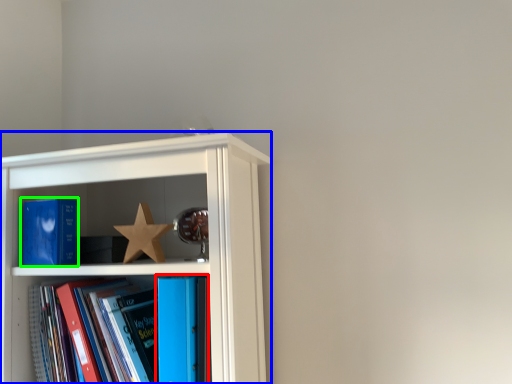
Question: Considering the real-world distances, which object is closest to book (highlighted by a red box)? shelf (highlighted by a blue box) or book (highlighted by a green box).

Choices:
 (A) shelf
 (B) book

Answer: (A)